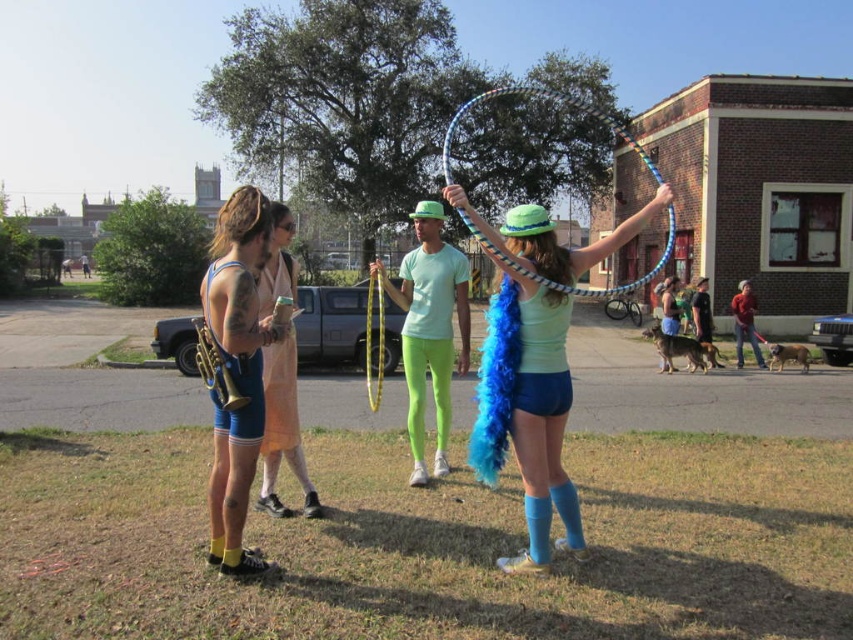
You are a photographer trying to capture a candid shot of the matte blue shorts at center and neon green leggings at center. Since you want to focus on both subjects, which one should you position closer to the camera to ensure they are both in focus without adjusting the camera settings?

To ensure both the matte blue shorts at center and neon green leggings at center are in focus without adjusting the camera settings, position the neon green leggings at center closer to the camera. Since the matte blue shorts at center is behind the neon green leggings at center, moving the leggings forward will align both subjects within the same focal plane.

You are a costume designer preparing for a performance. You have a blue feather boa at center and a multicolored plastic hula hoop at center. Which accessory is narrower?

The blue feather boa at center is narrower than the multicolored plastic hula hoop at center.